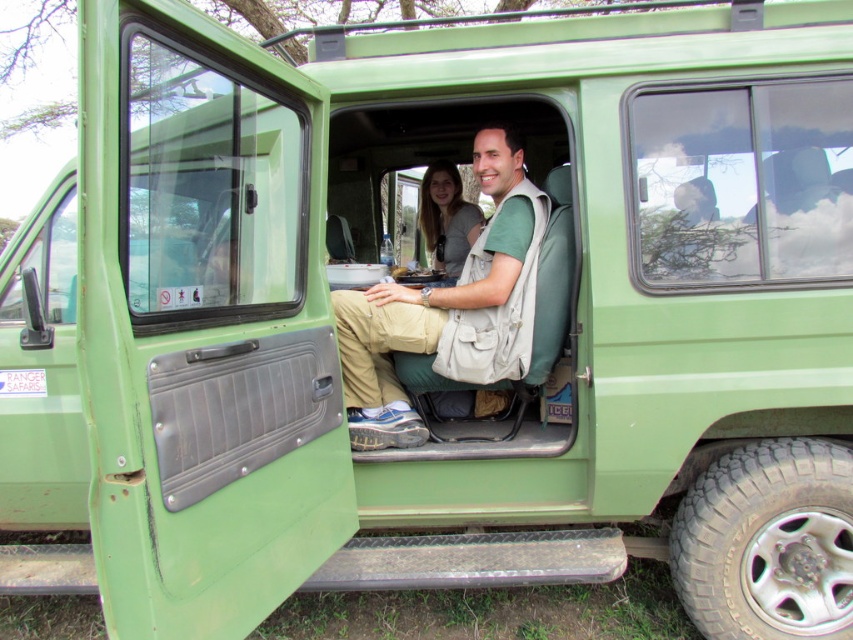
Which is more to the right, matte khaki pants at center or matte gray sweater at center?

matte khaki pants at center is more to the right.

Is point (352, 420) farther from viewer compared to point (430, 209)?

No, it is in front of (430, 209).

Is point (521, 168) positioned after point (473, 240)?

No, it is not.

Find the location of a particular element. The image size is (853, 640). matte khaki pants at center is located at coordinates (448, 307).